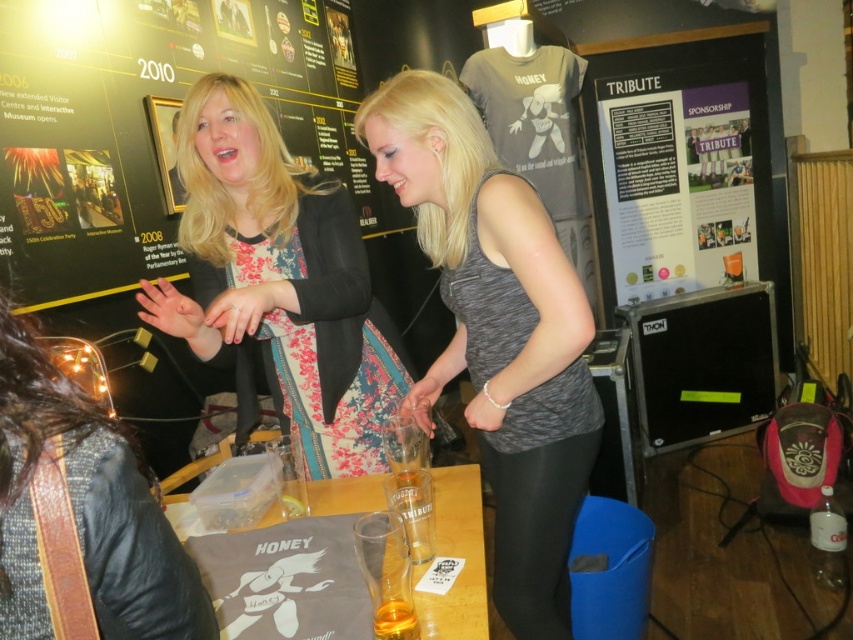
You are a photographer at the event and want to take a photo of the gray matte tank top at center and the white paper at upper center in the same frame. The camera you have can capture objects within a 2.5 meter range. Will both items fit in the shot?

The distance between the gray matte tank top at center and the white paper at upper center is 2.34 meters, which is within the camera range of 2.5 meters. Therefore, both items will fit in the shot.

What are the coordinates of the black matte poster at upper center?

The coordinates of the black matte poster at upper center are 0.197 in the x direction and 0.174 in the y direction.

You are organizing a photo shoot and need to ensure that the gray matte tank top at center and the white paper at upper center are both visible in the frame. Given their sizes, which object should you prioritize positioning closer to the camera to maintain clarity?

The gray matte tank top at center is larger in size than the white paper at upper center, so you should prioritize positioning the white paper at upper center closer to the camera to maintain clarity since smaller objects need to be closer for better visibility.